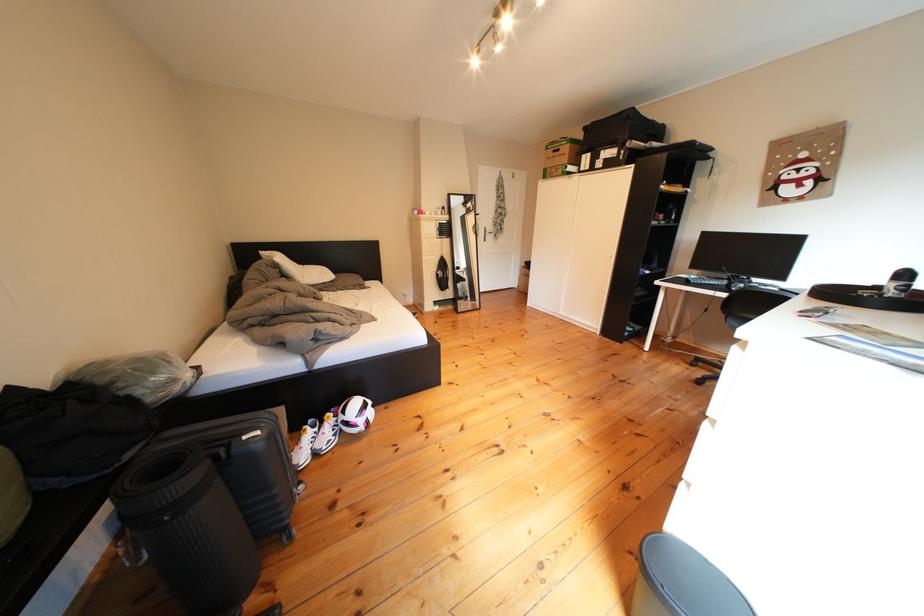
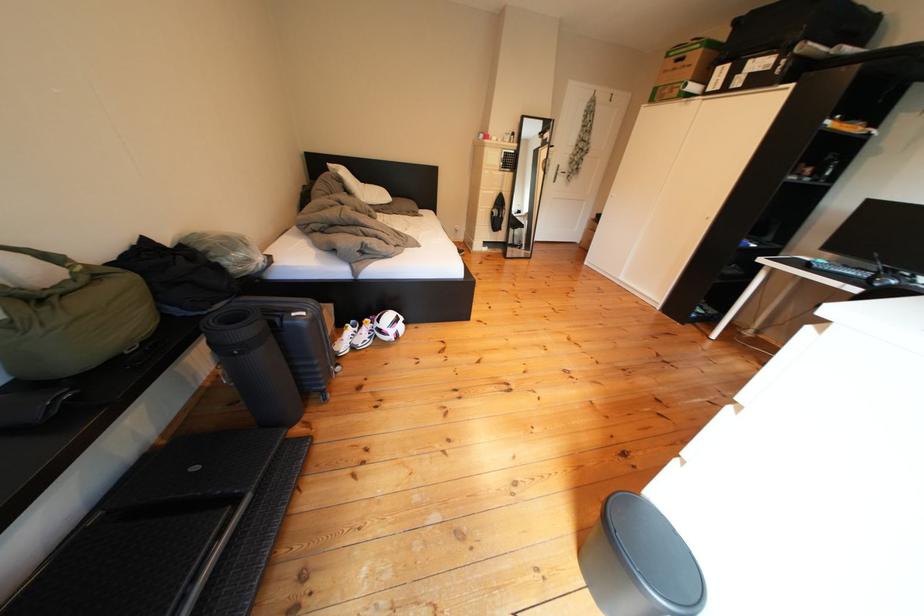
In the second image, find the point that corresponds to point 306,444 in the first image.

(350, 338)